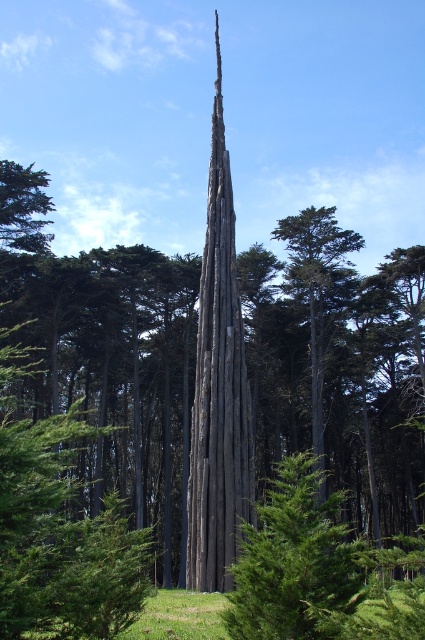
Question: Which point is farther to the camera?

Choices:
 (A) dark gray wood at center
 (B) dark gray wood tower at center

Answer: (A)

Question: Is dark gray wood at center smaller than dark gray wood tower at center?

Choices:
 (A) yes
 (B) no

Answer: (B)

Question: Does dark gray wood at center lie behind dark gray wood tower at center?

Choices:
 (A) no
 (B) yes

Answer: (B)

Question: Which of the following is the farthest from the observer?

Choices:
 (A) [x=198, y=586]
 (B) [x=385, y=385]

Answer: (B)

Question: Is dark gray wood at center to the right of dark gray wood tower at center from the viewer's perspective?

Choices:
 (A) no
 (B) yes

Answer: (B)